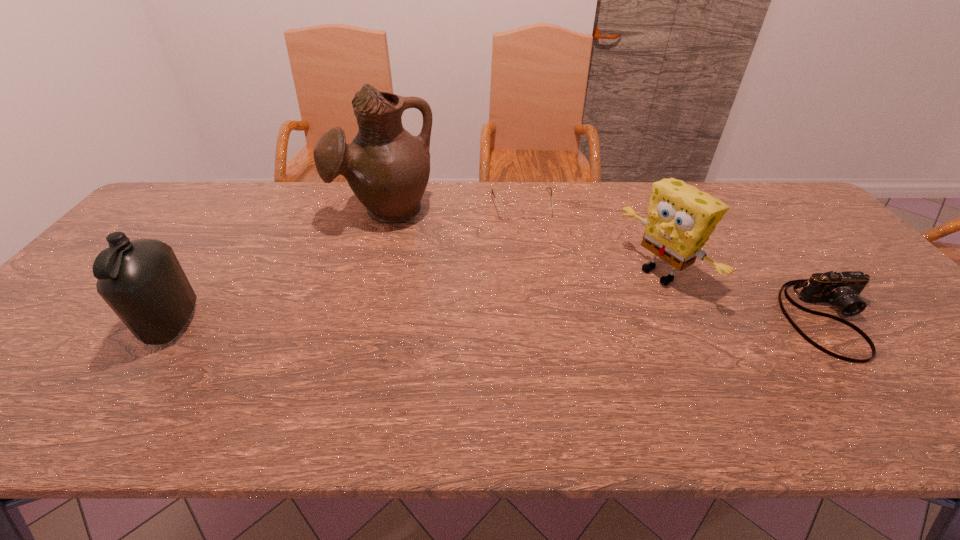
Identify the location of free spot located through the lenses of the spectacles. (538, 273).

I want to click on free space located through the lenses of the spectacles, so click(544, 305).

Find the location of a particular element. vacant space located 0.120m at the spout of the pitcher is located at coordinates (398, 261).

Where is `vacant space located at the spout of the pitcher`? vacant space located at the spout of the pitcher is located at coordinates (400, 270).

In order to click on vacant space situated at the spout of the pitcher in this screenshot , I will do [x=409, y=308].

Locate an element on the screen. vacant area situated 0.060m on the face of the sponge is located at coordinates (621, 303).

Locate an element on the screen. The width and height of the screenshot is (960, 540). free space located 0.400m on the face of the sponge is located at coordinates (514, 364).

You are a GUI agent. You are given a task and a screenshot of the screen. Output one action in this format:
    pyautogui.click(x=<x>, y=<y>)
    Task: Click on the vacant point located on the face of the sponge
    
    Given the screenshot: What is the action you would take?
    pyautogui.click(x=555, y=341)

The image size is (960, 540). I want to click on spectacles that is at the far edge, so click(539, 210).

The image size is (960, 540). Find the location of `pitcher that is at the far edge`. pitcher that is at the far edge is located at coordinates (387, 168).